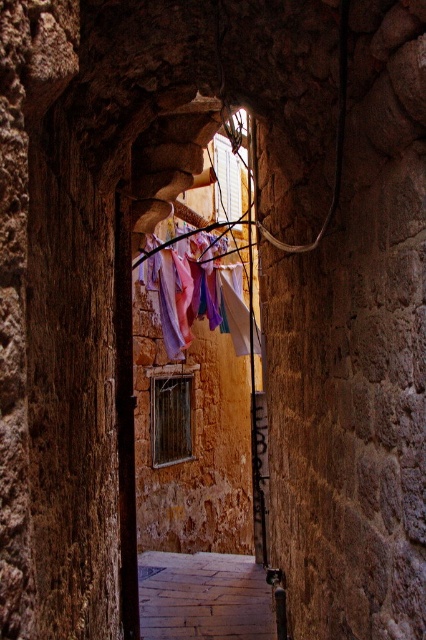
Is point (149, 576) positioned behind point (147, 275)?

No, it is in front of (147, 275).

From the picture: Is smooth stone alley at center smaller than pastel fabric at center?

Yes.

I want to click on smooth stone alley at center, so click(204, 596).

Locate an element on the screen. smooth stone alley at center is located at coordinates (204, 596).